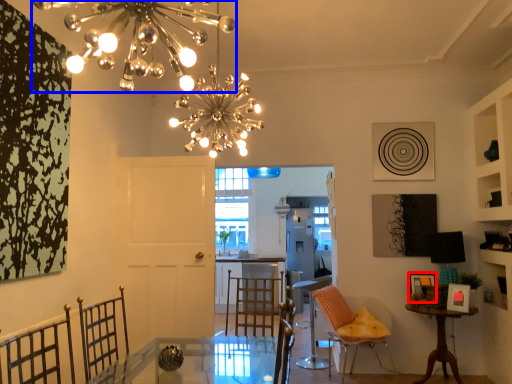
Question: Which of the following is the farthest to the observer, picture frame (highlighted by a red box) or chandelier (highlighted by a blue box)?

Choices:
 (A) picture frame
 (B) chandelier

Answer: (A)